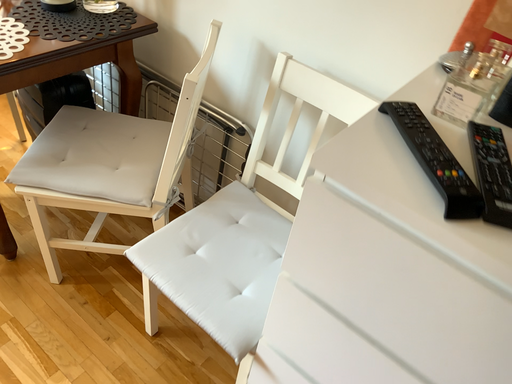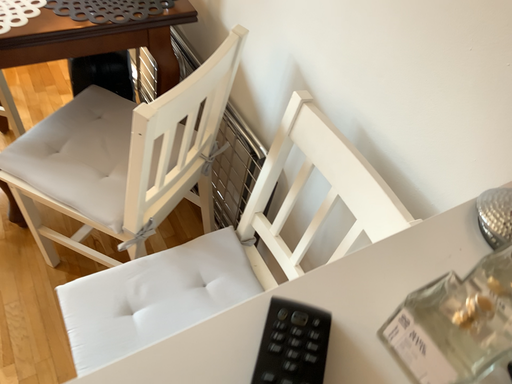
Question: Which way did the camera rotate in the video?

Choices:
 (A) rotated left
 (B) rotated right

Answer: (A)